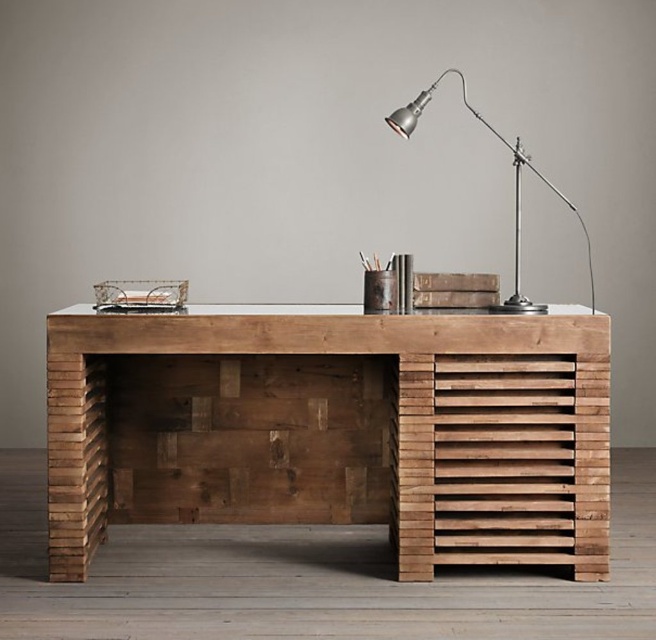
You are organizing your workspace and want to place a new 15cm wide decorative item on the desk. Considering the natural wood desk at center and the metallic silver desk lamp at upper right, which object has enough space horizontally to accommodate the item?

The natural wood desk at center has a greater width than the metallic silver desk lamp at upper right, so placing the 15cm wide decorative item on the natural wood desk at center would provide sufficient horizontal space.

You are organizing your workspace and need to place a new book on the desk. The metallic silver desk lamp at upper right is in the way. Can you move the book to the natural wood desk at center without moving the lamp?

Yes, since the natural wood desk at center is positioned under the metallic silver desk lamp at upper right, you can place the book on the desk without moving the lamp as they are vertically aligned.